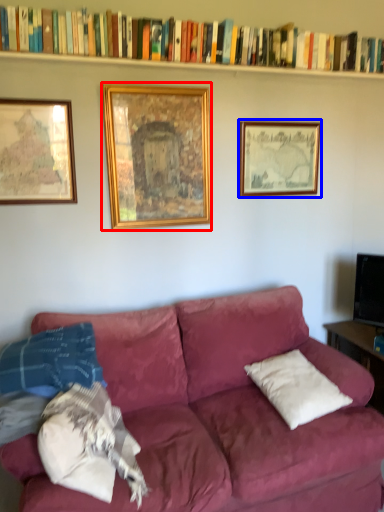
Question: Which point is closer to the camera, picture frame (highlighted by a red box) or picture frame (highlighted by a blue box)?

Choices:
 (A) picture frame
 (B) picture frame

Answer: (A)